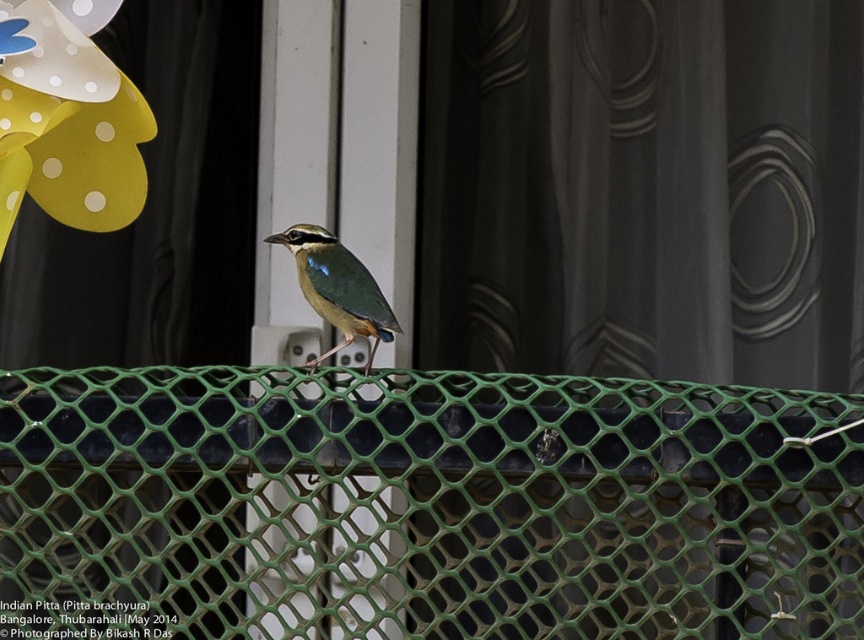
Is black fabric curtain at upper left positioned at the back of shiny blue-green bird at center?

No, black fabric curtain at upper left is in front of shiny blue-green bird at center.

Does black fabric curtain at upper left appear on the right side of shiny blue-green bird at center?

In fact, black fabric curtain at upper left is to the left of shiny blue-green bird at center.

Between point (75, 593) and point (315, 244), which one is positioned in front?

Point (315, 244) is more forward.

Find the location of `black fabric curtain at upper left`. black fabric curtain at upper left is located at coordinates (156, 211).

Who is more forward, (0, 316) or (0, 112)?

Point (0, 112)

Based on the photo, who is lower down, black fabric curtain at upper left or yellow paper flower at upper left?

black fabric curtain at upper left is lower down.

Which is in front, point (198, 70) or point (129, 198)?

Point (129, 198) is in front.

Image resolution: width=864 pixels, height=640 pixels. I want to click on black fabric curtain at upper left, so click(x=156, y=211).

Is matte gray curtain at center shorter than shiny blue-green bird at center?

Incorrect, matte gray curtain at center's height does not fall short of shiny blue-green bird at center's.

Who is more distant from viewer, (796, 392) or (312, 236)?

The point (312, 236) is more distant.

This screenshot has height=640, width=864. Find the location of `matte gray curtain at center`. matte gray curtain at center is located at coordinates click(643, 189).